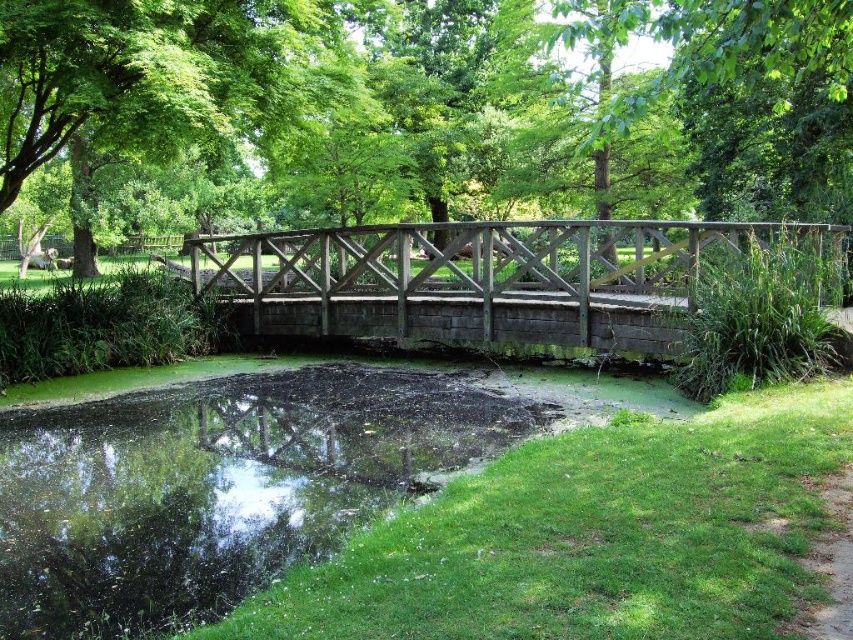
Which of these two, green wood bridge at center or green algae water at bottom left, stands shorter?

Standing shorter between the two is green algae water at bottom left.

Does green wood bridge at center have a lesser height compared to green algae water at bottom left?

In fact, green wood bridge at center may be taller than green algae water at bottom left.

Between point (701, 163) and point (155, 474), which one is positioned behind?

The point (701, 163) is behind.

You are a GUI agent. You are given a task and a screenshot of the screen. Output one action in this format:
    pyautogui.click(x=<x>, y=<y>)
    Task: Click on the green wood bridge at center
    
    Given the screenshot: What is the action you would take?
    pyautogui.click(x=433, y=106)

Is green wood bridge at center above wooden bridge at center?

Indeed, green wood bridge at center is positioned over wooden bridge at center.

Between green wood bridge at center and wooden bridge at center, which one has less height?

wooden bridge at center is shorter.

Between point (283, 164) and point (625, 323), which one is positioned behind?

The point (283, 164) is behind.

The width and height of the screenshot is (853, 640). Identify the location of green wood bridge at center. (433, 106).

Which is above, green algae water at bottom left or wooden bridge at center?

wooden bridge at center is higher up.

Which is more to the right, green algae water at bottom left or wooden bridge at center?

wooden bridge at center is more to the right.

Who is more forward, (x=334, y=385) or (x=672, y=292)?

Point (x=334, y=385) is in front.

Locate an element on the screen. The image size is (853, 640). green algae water at bottom left is located at coordinates (218, 486).